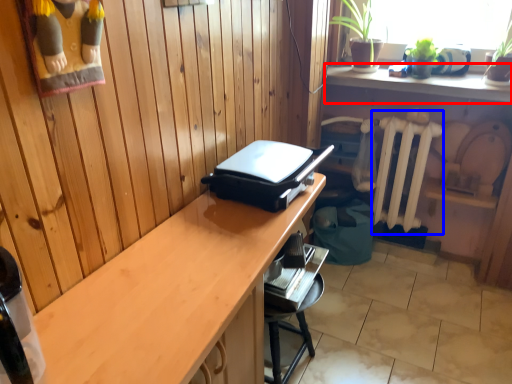
Question: Which point is further to the camera, shelf (highlighted by a red box) or radiator (highlighted by a blue box)?

Choices:
 (A) shelf
 (B) radiator

Answer: (B)